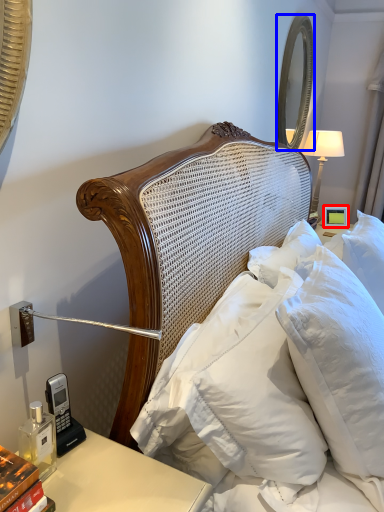
Question: Which object appears closest to the camera in this image, picture frame (highlighted by a red box) or mirror (highlighted by a blue box)?

Choices:
 (A) picture frame
 (B) mirror

Answer: (B)